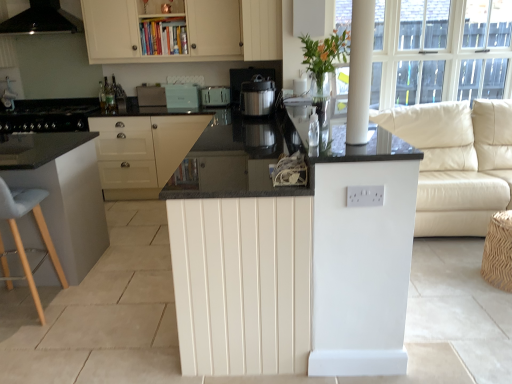
The image size is (512, 384). What are the coordinates of `vacant area situated to the left side of brown woven stool at lower right, positioned as the 2th bar stool in left-to-right order` in the screenshot? It's located at (462, 288).